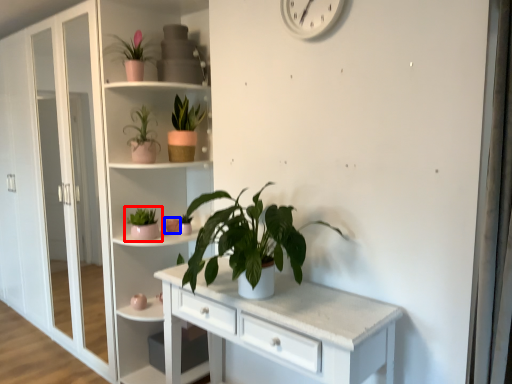
Question: Which object is closer to the camera taking this photo, houseplant (highlighted by a red box) or flower (highlighted by a blue box)?

Choices:
 (A) houseplant
 (B) flower

Answer: (A)